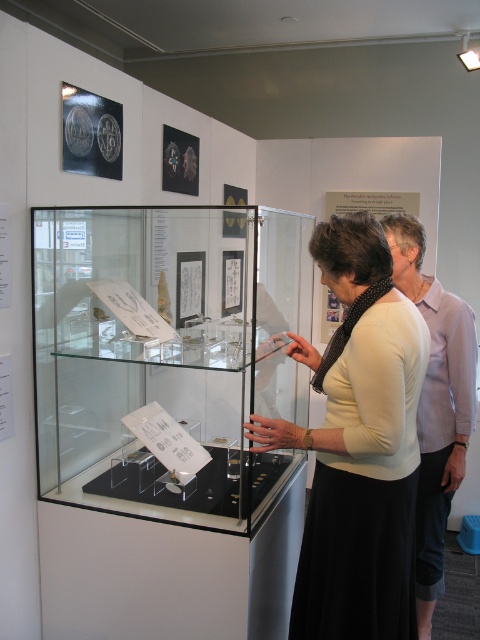
You are standing in front of the glass case in the museum. There is a point labeled as point (336, 289). If you want to touch this point, will you be able to reach it without moving your position?

The point (336, 289) is 1.58 meters away from the camera, so you can reach it without moving your position if your arm can extend that far.

In the scene shown: You are a security guard in the museum and need to ensure visitors are not too close to the glass case. The rule states that visitors must stay at least 1 meter away from the case. The white matte sweater at center and the light purple shirt at right are both near the case. Which visitor is violating the rule?

The white matte sweater at center is closer to the viewer than the light purple shirt at right, so the white matte sweater at center is violating the rule since they are closer to the glass case.

You are standing in the museum and see the clear glass case at center and the white matte sweater at center. Which object is closer to you?

The clear glass case at center is closer to you than the white matte sweater at center because it is positioned over it.